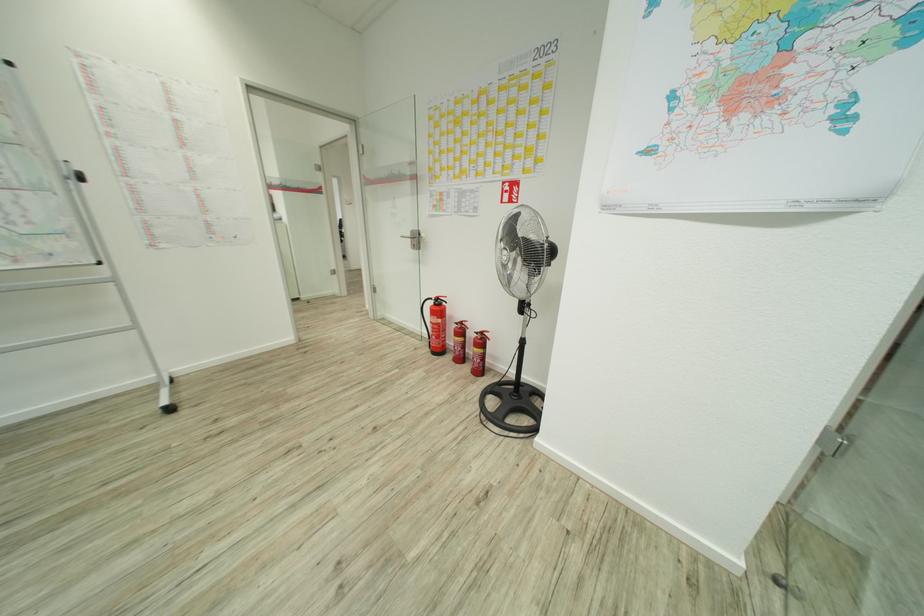
This screenshot has height=616, width=924. Describe the element at coordinates (412, 238) in the screenshot. I see `a silver door handle` at that location.